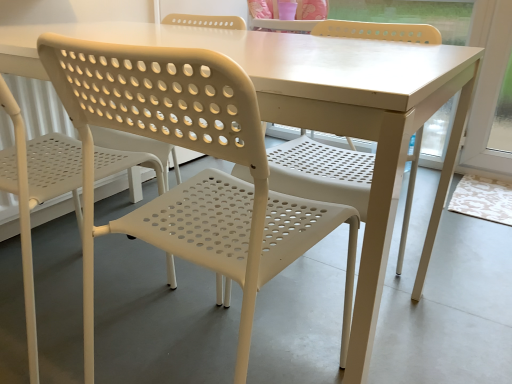
Image resolution: width=512 pixels, height=384 pixels. In order to click on white plastic chair at center, which appears as the first chair when viewed from the right in this screenshot , I will do `click(194, 176)`.

What do you see at coordinates (194, 176) in the screenshot?
I see `white plastic chair at center, which appears as the first chair when viewed from the right` at bounding box center [194, 176].

You are a GUI agent. You are given a task and a screenshot of the screen. Output one action in this format:
    pyautogui.click(x=<x>, y=<y>)
    Task: Click on the white plastic chair at left, the 1th chair in the left-to-right sequence
    
    Given the screenshot: What is the action you would take?
    pyautogui.click(x=37, y=192)

The image size is (512, 384). Describe the element at coordinates (37, 192) in the screenshot. I see `white plastic chair at left, the 2th chair when ordered from right to left` at that location.

This screenshot has width=512, height=384. Identify the location of white plastic chair at center, which appears as the first chair when viewed from the right. (194, 176).

Which is more to the right, white plastic chair at center, which appears as the first chair when viewed from the right, or white plastic chair at left, the 2th chair when ordered from right to left?

From the viewer's perspective, white plastic chair at center, which appears as the first chair when viewed from the right, appears more on the right side.

Based on the photo, who is more distant, white plastic chair at center, the second chair in the left-to-right sequence, or white plastic chair at left, the 1th chair in the left-to-right sequence?

white plastic chair at left, the 1th chair in the left-to-right sequence, is more distant.

Between point (219, 247) and point (3, 183), which one is positioned in front?

The point (219, 247) is closer to the camera.

From the image's perspective, is white plastic chair at center, the second chair in the left-to-right sequence, below white plastic chair at left, the 1th chair in the left-to-right sequence?

Correct, white plastic chair at center, the second chair in the left-to-right sequence, appears lower than white plastic chair at left, the 1th chair in the left-to-right sequence, in the image.

From a real-world perspective, between white plastic chair at center, the second chair in the left-to-right sequence, and white plastic chair at left, the 2th chair when ordered from right to left, who is vertically higher?

In real-world perspective, white plastic chair at center, the second chair in the left-to-right sequence, is above.

Considering the relative sizes of white plastic chair at center, the second chair in the left-to-right sequence, and white plastic chair at left, the 2th chair when ordered from right to left, in the image provided, is white plastic chair at center, the second chair in the left-to-right sequence, wider than white plastic chair at left, the 2th chair when ordered from right to left,?

No.

Considering the sizes of objects white plastic chair at center, which appears as the first chair when viewed from the right, and white plastic chair at left, the 2th chair when ordered from right to left, in the image provided, who is taller, white plastic chair at center, which appears as the first chair when viewed from the right, or white plastic chair at left, the 2th chair when ordered from right to left,?

white plastic chair at left, the 2th chair when ordered from right to left.

Based on their sizes in the image, would you say white plastic chair at center, which appears as the first chair when viewed from the right, is bigger or smaller than white plastic chair at left, the 2th chair when ordered from right to left?

Considering their sizes, white plastic chair at center, which appears as the first chair when viewed from the right, takes up less space than white plastic chair at left, the 2th chair when ordered from right to left.

Consider the image. Would you say white plastic chair at center, the second chair in the left-to-right sequence, is outside white plastic chair at left, the 1th chair in the left-to-right sequence?

That's correct, white plastic chair at center, the second chair in the left-to-right sequence, is outside of white plastic chair at left, the 1th chair in the left-to-right sequence.

Is white plastic chair at center, which appears as the first chair when viewed from the right, far away from white plastic chair at left, the 2th chair when ordered from right to left?

Actually, white plastic chair at center, which appears as the first chair when viewed from the right, and white plastic chair at left, the 2th chair when ordered from right to left, are a little close together.

Could you tell me if white plastic chair at center, which appears as the first chair when viewed from the right, is facing white plastic chair at left, the 2th chair when ordered from right to left?

No, white plastic chair at center, which appears as the first chair when viewed from the right, is not aimed at white plastic chair at left, the 2th chair when ordered from right to left.

How many degrees apart are the facing directions of white plastic chair at center, which appears as the first chair when viewed from the right, and white plastic chair at left, the 2th chair when ordered from right to left?

The angular difference between white plastic chair at center, which appears as the first chair when viewed from the right, and white plastic chair at left, the 2th chair when ordered from right to left, is 0.000249 degrees.

How distant is white plastic chair at center, the second chair in the left-to-right sequence, from white plastic chair at left, the 2th chair when ordered from right to left?

The distance of white plastic chair at center, the second chair in the left-to-right sequence, from white plastic chair at left, the 2th chair when ordered from right to left, is 10.94 inches.

Image resolution: width=512 pixels, height=384 pixels. Find the location of `chair that is in front of the white plastic chair at left, the 2th chair when ordered from right to left`. chair that is in front of the white plastic chair at left, the 2th chair when ordered from right to left is located at coordinates (194, 176).

Which is more to the right, white plastic chair at left, the 2th chair when ordered from right to left, or white plastic chair at center, which appears as the first chair when viewed from the right?

From the viewer's perspective, white plastic chair at center, which appears as the first chair when viewed from the right, appears more on the right side.

Between white plastic chair at left, the 2th chair when ordered from right to left, and white plastic chair at center, which appears as the first chair when viewed from the right, which one is positioned in front?

white plastic chair at center, which appears as the first chair when viewed from the right, is closer to the camera.

Which is closer, (127,168) or (165,205)?

The point (165,205) is closer.

From the image's perspective, which one is positioned higher, white plastic chair at left, the 2th chair when ordered from right to left, or white plastic chair at center, the second chair in the left-to-right sequence?

From the image's view, white plastic chair at left, the 2th chair when ordered from right to left, is above.

From a real-world perspective, who is located higher, white plastic chair at left, the 2th chair when ordered from right to left, or white plastic chair at center, the second chair in the left-to-right sequence?

white plastic chair at center, the second chair in the left-to-right sequence.

Is white plastic chair at left, the 1th chair in the left-to-right sequence, wider or thinner than white plastic chair at center, the second chair in the left-to-right sequence?

In the image, white plastic chair at left, the 1th chair in the left-to-right sequence, appears to be wider than white plastic chair at center, the second chair in the left-to-right sequence.

Is white plastic chair at left, the 2th chair when ordered from right to left, taller or shorter than white plastic chair at center, the second chair in the left-to-right sequence?

white plastic chair at left, the 2th chair when ordered from right to left, is taller than white plastic chair at center, the second chair in the left-to-right sequence.

Who is smaller, white plastic chair at left, the 1th chair in the left-to-right sequence, or white plastic chair at center, the second chair in the left-to-right sequence?

white plastic chair at center, the second chair in the left-to-right sequence.

Is white plastic chair at left, the 1th chair in the left-to-right sequence, inside the boundaries of white plastic chair at center, the second chair in the left-to-right sequence, or outside?

white plastic chair at left, the 1th chair in the left-to-right sequence, cannot be found inside white plastic chair at center, the second chair in the left-to-right sequence.

Is white plastic chair at left, the 2th chair when ordered from right to left, placed right next to white plastic chair at center, the second chair in the left-to-right sequence?

They are not placed beside each other.

Is white plastic chair at left, the 1th chair in the left-to-right sequence, turned away from white plastic chair at center, the second chair in the left-to-right sequence?

That's not correct — white plastic chair at left, the 1th chair in the left-to-right sequence, is not looking away from white plastic chair at center, the second chair in the left-to-right sequence.

How many degrees apart are the facing directions of white plastic chair at left, the 1th chair in the left-to-right sequence, and white plastic chair at center, the second chair in the left-to-right sequence?

white plastic chair at left, the 1th chair in the left-to-right sequence, and white plastic chair at center, the second chair in the left-to-right sequence, are facing 0.000249 degrees away from each other.

Measure the distance from white plastic chair at left, the 2th chair when ordered from right to left, to white plastic chair at center, the second chair in the left-to-right sequence.

white plastic chair at left, the 2th chair when ordered from right to left, and white plastic chair at center, the second chair in the left-to-right sequence, are 10.94 inches apart.

Locate an element on the screen. The height and width of the screenshot is (384, 512). chair on the left of the white plastic chair at center, which appears as the first chair when viewed from the right is located at coordinates (37, 192).

The image size is (512, 384). Identify the location of chair in front of the white plastic chair at left, the 2th chair when ordered from right to left. (194, 176).

Identify the location of chair above the white plastic chair at left, the 2th chair when ordered from right to left (from a real-world perspective). (194, 176).